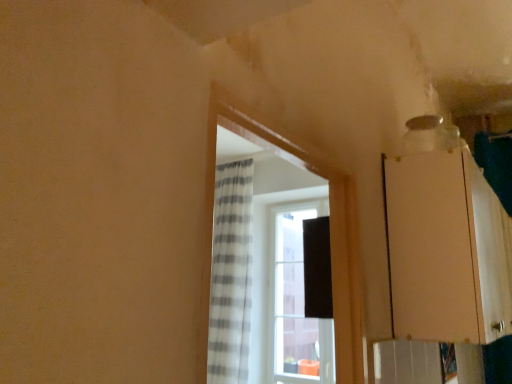
Question: Is white striped curtain at center positioned with its back to matte wood cabinet at right?

Choices:
 (A) yes
 (B) no

Answer: (B)

Question: From the image's perspective, is white striped curtain at center on matte wood cabinet at right?

Choices:
 (A) no
 (B) yes

Answer: (B)

Question: From a real-world perspective, is white striped curtain at center located beneath matte wood cabinet at right?

Choices:
 (A) no
 (B) yes

Answer: (B)

Question: Can you confirm if white striped curtain at center is positioned to the right of matte wood cabinet at right?

Choices:
 (A) no
 (B) yes

Answer: (A)

Question: Considering the relative sizes of white striped curtain at center and matte wood cabinet at right in the image provided, is white striped curtain at center bigger than matte wood cabinet at right?

Choices:
 (A) no
 (B) yes

Answer: (A)

Question: Can you see white striped curtain at center touching matte wood cabinet at right?

Choices:
 (A) no
 (B) yes

Answer: (A)

Question: Does matte wood cabinet at right have a greater width compared to white striped curtain at center?

Choices:
 (A) no
 (B) yes

Answer: (B)

Question: Is matte wood cabinet at right facing towards white striped curtain at center?

Choices:
 (A) yes
 (B) no

Answer: (B)

Question: Considering the relative positions of matte wood cabinet at right and white striped curtain at center in the image provided, is matte wood cabinet at right to the left of white striped curtain at center from the viewer's perspective?

Choices:
 (A) yes
 (B) no

Answer: (B)

Question: Is matte wood cabinet at right turned away from white striped curtain at center?

Choices:
 (A) no
 (B) yes

Answer: (A)

Question: Are matte wood cabinet at right and white striped curtain at center making contact?

Choices:
 (A) yes
 (B) no

Answer: (B)

Question: Can you confirm if matte wood cabinet at right is positioned to the right of white striped curtain at center?

Choices:
 (A) yes
 (B) no

Answer: (A)

Question: From the image's perspective, relative to matte wood cabinet at right, is white striped curtain at center above or below?

Choices:
 (A) above
 (B) below

Answer: (A)